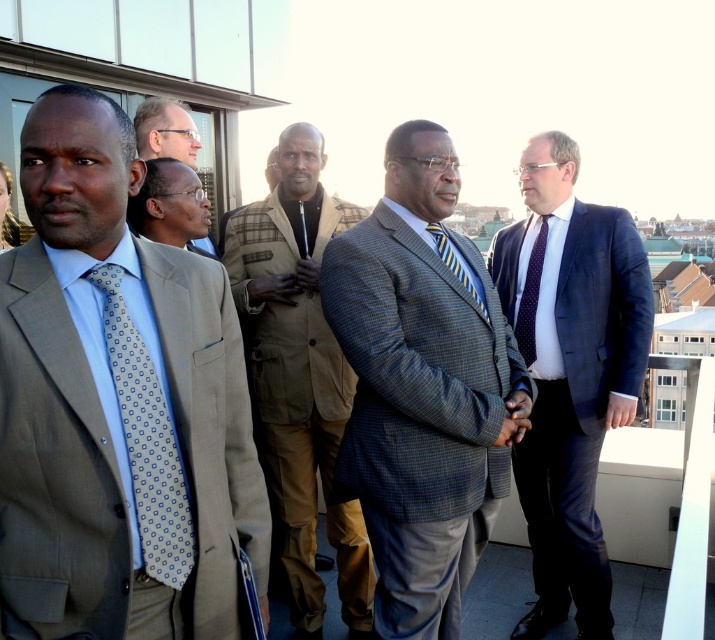
Question: Which of the following is the farthest from the observer?

Choices:
 (A) (453, 264)
 (B) (113, 122)

Answer: (A)

Question: Can you confirm if blue plaid suit at center is bigger than dark blue dotted tie at right?

Choices:
 (A) yes
 (B) no

Answer: (A)

Question: Which point appears closest to the camera in this image?

Choices:
 (A) (114, 374)
 (B) (435, 241)
 (C) (512, 244)

Answer: (A)

Question: Which of these objects is positioned closest to the light brown suit at center?

Choices:
 (A) blue plaid suit at center
 (B) plaid wool jacket at center
 (C) blue textured suit at right

Answer: (B)

Question: Does blue textured suit at right appear on the left side of light blue dotted tie at left?

Choices:
 (A) yes
 (B) no

Answer: (B)

Question: Does blue plaid suit at center appear over striped silk tie at center?

Choices:
 (A) yes
 (B) no

Answer: (B)